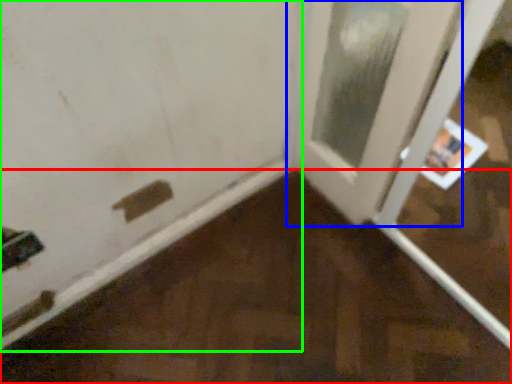
Question: Based on their relative distances, which object is nearer to plywood (highlighted by a red box)? Choose from door (highlighted by a blue box) and door (highlighted by a green box).

Choices:
 (A) door
 (B) door

Answer: (B)